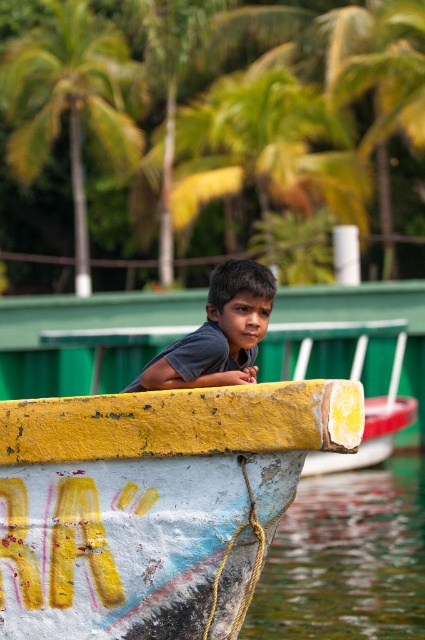
Question: Which object is farther from the camera taking this photo?

Choices:
 (A) gray matte shirt at center
 (B) yellow painted wood boat at center
 (C) yellow painted letters at boat front

Answer: (A)

Question: Which object is farther from the camera taking this photo?

Choices:
 (A) transparent water at lower left
 (B) green leafy palm tree at upper left
 (C) yellow painted letters at boat front

Answer: (B)

Question: In this image, where is transparent water at lower left located relative to gray matte shirt at center?

Choices:
 (A) below
 (B) above

Answer: (A)

Question: Based on their relative distances, which object is farther from the yellow painted wood boat at center?

Choices:
 (A) transparent water at lower left
 (B) yellow painted letters at boat front

Answer: (A)

Question: Is transparent water at lower left in front of green leafy palm tree at upper left?

Choices:
 (A) yes
 (B) no

Answer: (A)

Question: Can you confirm if yellow painted letters at boat front is positioned to the left of gray matte shirt at center?

Choices:
 (A) yes
 (B) no

Answer: (A)